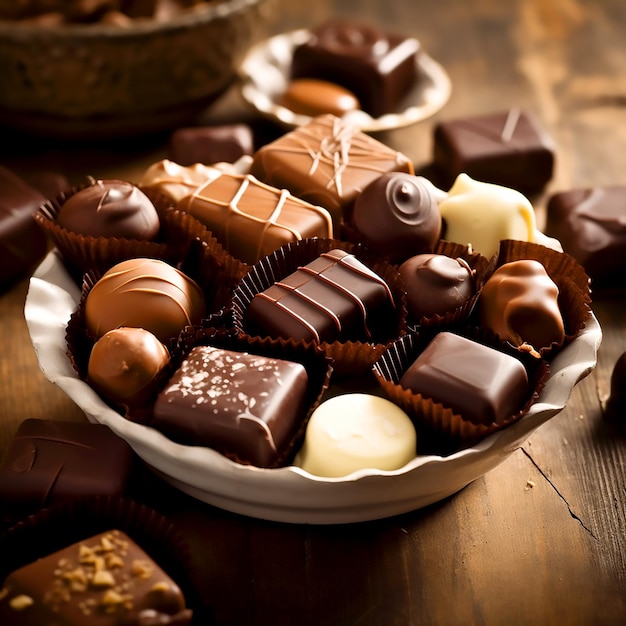
Find the location of `large visible crumbs on table`. large visible crumbs on table is located at coordinates (525, 481), (563, 442), (583, 414), (529, 439), (408, 529).